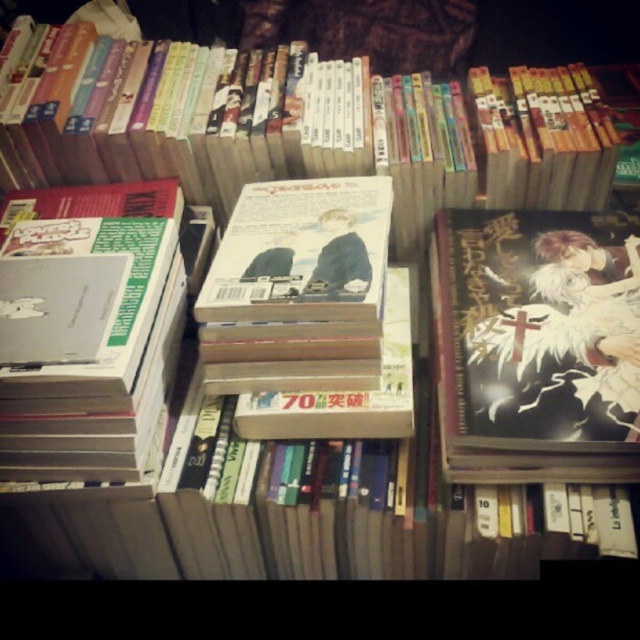
Question: Which of the following is the closest to the observer?

Choices:
 (A) (566, 362)
 (B) (323, 216)

Answer: (A)

Question: Among these points, which one is farthest from the camera?

Choices:
 (A) (625, 266)
 (B) (340, 291)

Answer: (A)

Question: Where is black matte manga at center located in relation to matte paperback book at center in the image?

Choices:
 (A) left
 (B) right

Answer: (B)

Question: Does black matte manga at center appear on the right side of matte paperback book at center?

Choices:
 (A) yes
 (B) no

Answer: (A)

Question: Can you confirm if black matte manga at center is positioned to the left of matte paperback book at center?

Choices:
 (A) no
 (B) yes

Answer: (A)